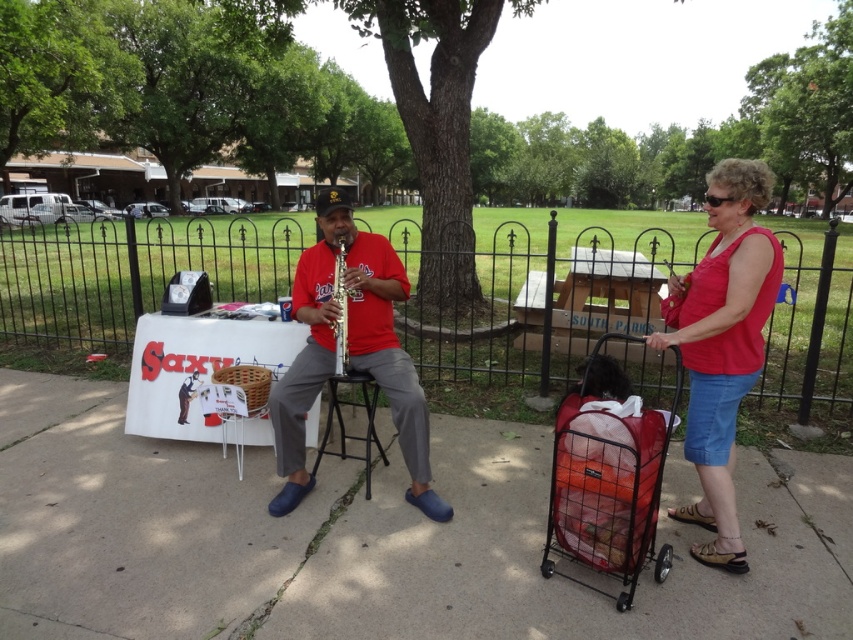
You are a pedestrian walking on the concrete sidewalk at center and you want to place a small backpack on the matte red shirt at center. Is the backpack within reach from your current position?

The concrete sidewalk at center is below matte red shirt at center, so the backpack can be placed on the matte red shirt at center from the sidewalk.